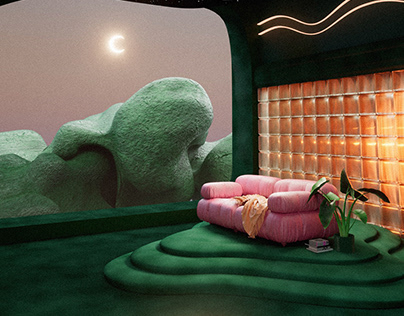
Locate an element on the screen. This screenshot has width=404, height=316. wave lights is located at coordinates (284, 19), (347, 16).